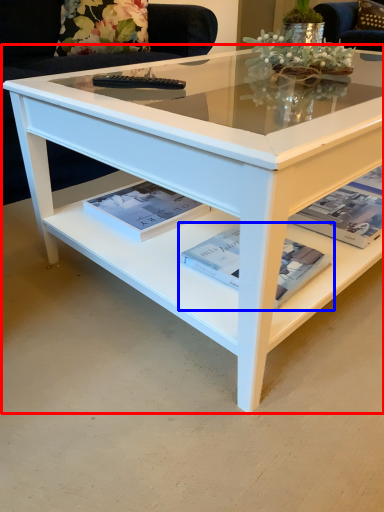
Question: Which of the following is the farthest to the observer, coffee table (highlighted by a red box) or magazine (highlighted by a blue box)?

Choices:
 (A) coffee table
 (B) magazine

Answer: (B)